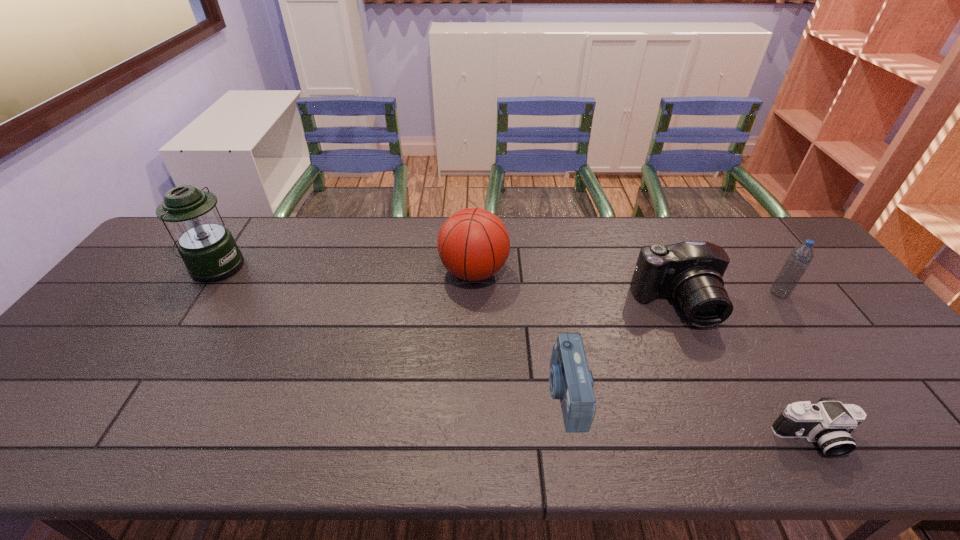
Where is `vacant space located 0.070m on the lens of the tallest camera`? vacant space located 0.070m on the lens of the tallest camera is located at coordinates (698, 352).

The height and width of the screenshot is (540, 960). I want to click on vacant space positioned 0.090m on the lens of the leftmost camera, so click(511, 393).

Identify the location of free space located 0.070m on the lens of the leftmost camera. (519, 393).

Identify the location of free spot located on the lens of the leftmost camera. This screenshot has width=960, height=540. (403, 393).

This screenshot has height=540, width=960. I want to click on lantern at the far edge, so click(208, 249).

Find the location of a particular element. This screenshot has height=540, width=960. basketball situated at the far edge is located at coordinates (473, 244).

Find the location of a particular element. object that is at the left edge is located at coordinates (208, 249).

At what (x,y) coordinates should I click in order to perform the action: click on object at the right edge. Please return your answer as a coordinate pair (x, y). This screenshot has width=960, height=540. Looking at the image, I should click on (801, 256).

This screenshot has height=540, width=960. What are the coordinates of `object present at the far left corner` in the screenshot? It's located at (208, 249).

This screenshot has height=540, width=960. In the image, there is a desktop. What are the coordinates of `vacant region at the far edge` in the screenshot? It's located at (516, 223).